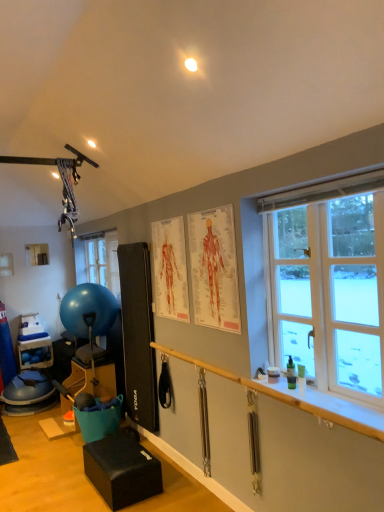
Question: Is black leather cushion at lower center, acting as the 2th furniture starting from the back, oriented towards white plastic window sill at lower right?

Choices:
 (A) yes
 (B) no

Answer: (B)

Question: Does black leather cushion at lower center, marked as the 2th furniture in a left-to-right arrangement, have a larger size compared to white plastic window sill at lower right?

Choices:
 (A) no
 (B) yes

Answer: (B)

Question: Is white plastic window sill at lower right at the back of black leather cushion at lower center, acting as the 2th furniture starting from the back?

Choices:
 (A) yes
 (B) no

Answer: (B)

Question: Is black leather cushion at lower center, which ranks as the first furniture in right-to-left order, wider than white plastic window sill at lower right?

Choices:
 (A) yes
 (B) no

Answer: (A)

Question: Is black leather cushion at lower center, acting as the 2th furniture starting from the back, to the right of white plastic window sill at lower right from the viewer's perspective?

Choices:
 (A) yes
 (B) no

Answer: (B)

Question: From a real-world perspective, is matte black exercise ball at left, which is the first furniture in left-to-right order, above or below black leather cushion at lower center, marked as the 2th furniture in a left-to-right arrangement?

Choices:
 (A) below
 (B) above

Answer: (B)

Question: Visually, is matte black exercise ball at left, arranged as the 2th furniture when viewed from the front, positioned to the left or to the right of black leather cushion at lower center, acting as the 2th furniture starting from the back?

Choices:
 (A) left
 (B) right

Answer: (A)

Question: From their relative heights in the image, would you say matte black exercise ball at left, which is the 2th furniture from right to left, is taller or shorter than black leather cushion at lower center, which is the first furniture in front-to-back order?

Choices:
 (A) tall
 (B) short

Answer: (A)

Question: Does point (112, 361) appear closer or farther from the camera than point (127, 442)?

Choices:
 (A) farther
 (B) closer

Answer: (A)

Question: Considering their positions, is white plastic window sill at lower right located in front of or behind white glass window at right?

Choices:
 (A) behind
 (B) front

Answer: (B)

Question: Considering the positions of white plastic window sill at lower right and white glass window at right in the image, is white plastic window sill at lower right wider or thinner than white glass window at right?

Choices:
 (A) thin
 (B) wide

Answer: (B)

Question: Does point (258, 384) appear closer or farther from the camera than point (284, 280)?

Choices:
 (A) farther
 (B) closer

Answer: (B)

Question: From a real-world perspective, is white plastic window sill at lower right above or below white glass window at right?

Choices:
 (A) above
 (B) below

Answer: (B)

Question: Which is correct: white glass window at right is inside blue rubber ball at left, or outside of it?

Choices:
 (A) outside
 (B) inside

Answer: (A)

Question: Considering the positions of white glass window at right and blue rubber ball at left in the image, is white glass window at right wider or thinner than blue rubber ball at left?

Choices:
 (A) thin
 (B) wide

Answer: (A)